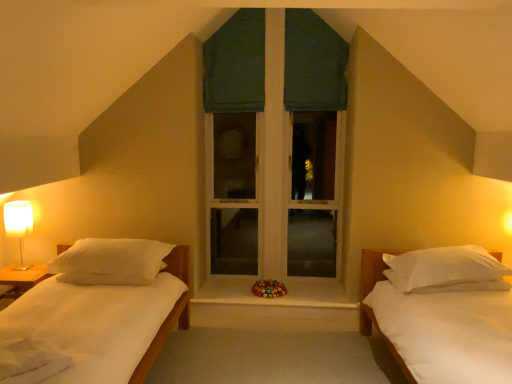
This screenshot has height=384, width=512. Identify the location of free location above wooden at center (from a real-world perspective). (260, 292).